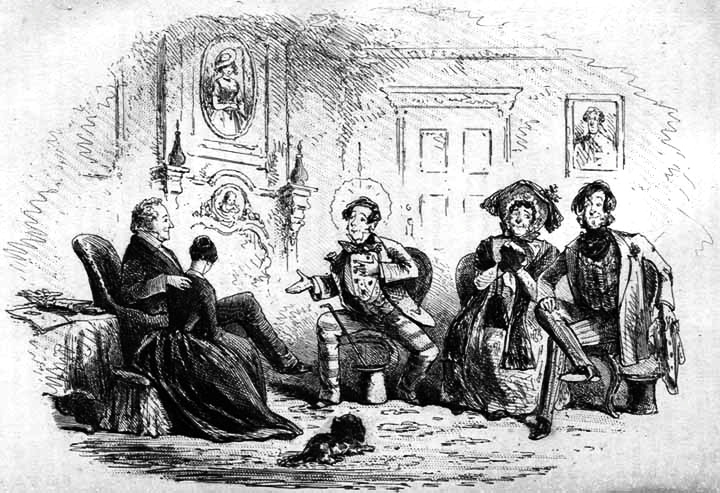
I want to click on ceiling, so click(433, 36).